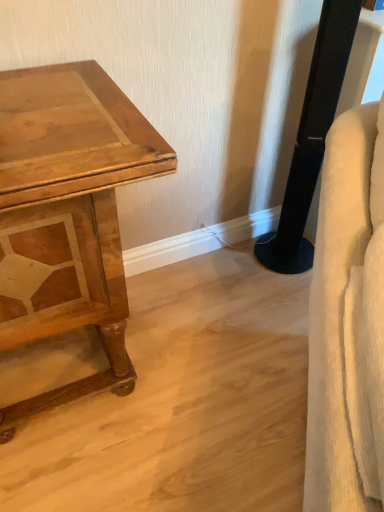
The image size is (384, 512). Find the location of `vacant space situated above wooden table at left (from a real-world perspective)`. vacant space situated above wooden table at left (from a real-world perspective) is located at coordinates (49, 109).